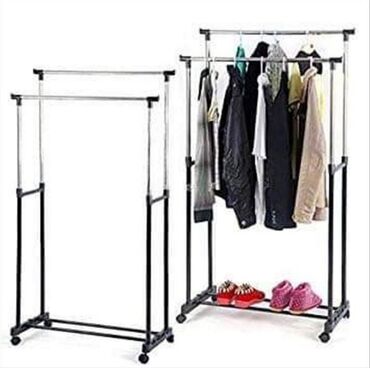
Image resolution: width=370 pixels, height=368 pixels. Identify the location of hangers. (242, 37), (263, 36), (274, 37), (307, 37), (311, 62), (284, 65), (261, 67), (239, 64), (212, 65).